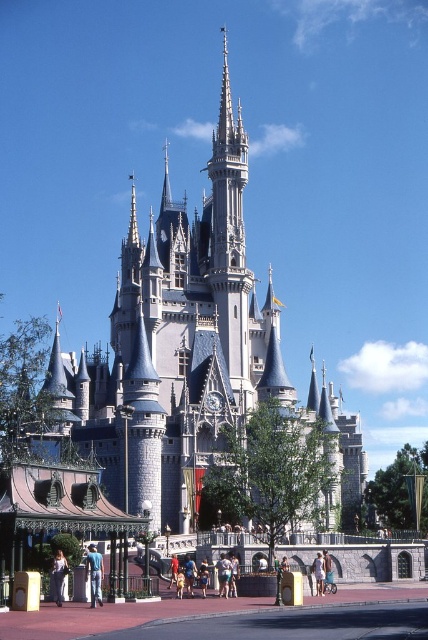
Question: Can you confirm if denim jeans at lower left is positioned above light brown leather pants at center?

Choices:
 (A) no
 (B) yes

Answer: (B)

Question: Is the position of denim jeans at lower left less distant than that of light brown leather jacket at center?

Choices:
 (A) yes
 (B) no

Answer: (A)

Question: Which object is positioned closest to the light brown fabric dress at lower left?

Choices:
 (A) light brown leather shoes at center
 (B) denim jeans at lower left
 (C) light brown leather jacket at center

Answer: (B)

Question: Which point appears closest to the camera in this image?

Choices:
 (A) (56, 564)
 (B) (228, 572)
 (C) (95, 589)
 (D) (231, 240)

Answer: (C)

Question: Which of the following is the farthest from the observer?

Choices:
 (A) (86, 573)
 (B) (225, 580)
 (C) (193, 564)

Answer: (C)

Question: Is light brown fabric dress at lower left further to camera compared to light blue denim shorts at center?

Choices:
 (A) yes
 (B) no

Answer: (B)